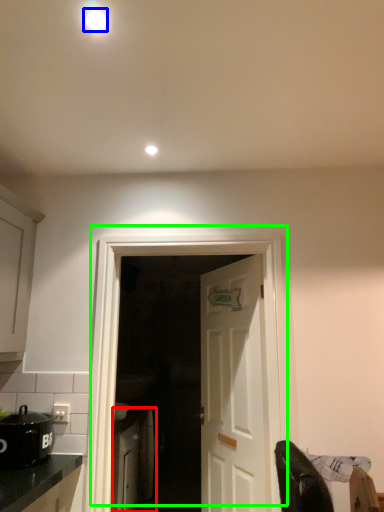
Question: Which is farther away from cabinetry (highlighted by a red box)? lighting (highlighted by a blue box) or door (highlighted by a green box)?

Choices:
 (A) lighting
 (B) door

Answer: (A)